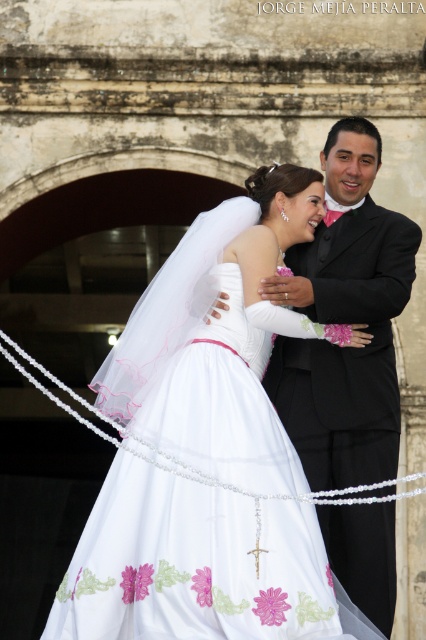
In the wedding scene, there is a point at coordinates (218, 337). What object is located at this point?

The point at coordinates (218, 337) corresponds to the white satin dress at center.

In the wedding scene, the bride is wearing a white satin dress at center and the groom is wearing a black satin suit at center. Which of their outfits takes up more space in the image?

The white satin dress at center is larger in size than the black satin suit at center, so the bride takes up more space in the image.

In the wedding scene, you notice the white satin dress at center and the black satin suit at center. Which one is positioned to the left?

The white satin dress at center is positioned to the left of the black satin suit at center.